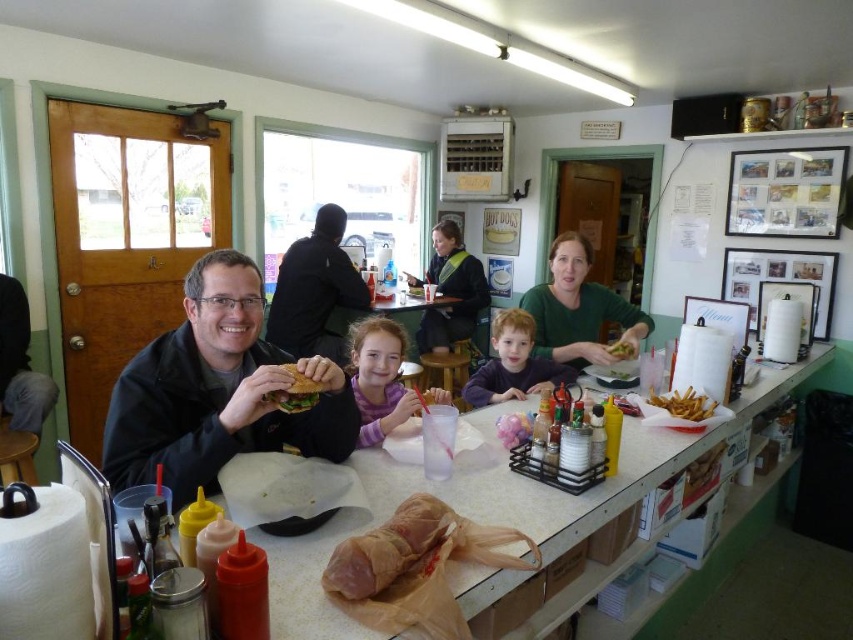
You are a photographer standing in front of the diner counter. You notice the green matte shirt at center and the matte brown sandwich at center. Which object is positioned higher relative to the other?

The green matte shirt at center is above the matte brown sandwich at center.

You are a photographer standing in the diner and want to take a photo of the purple cotton shirt at center and the matte green sandwich at center. Which object should you focus on first if you want to capture both in the same frame without moving the camera?

The purple cotton shirt at center is much taller than the matte green sandwich at center, so you should focus on the purple cotton shirt at center first to ensure it is in frame before adjusting the camera angle slightly downward to include the matte green sandwich at center.

You are a photographer trying to capture the family at the counter. You notice the green matte shirt at center and the matte brown sandwich at center. Which object should you focus on if you want to capture the wider one?

The green matte shirt at center is wider than the matte brown sandwich at center, so focus on the green matte shirt at center to capture the wider object.